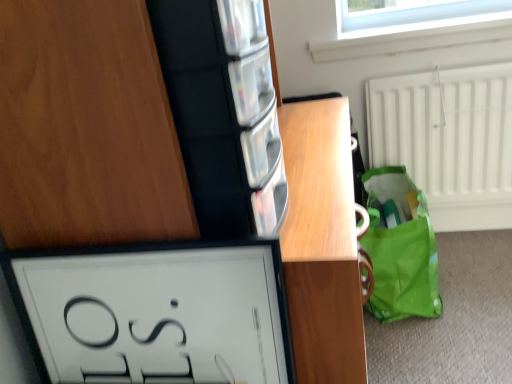
Question: From a real-world perspective, does green fabric tote at lower right stand above matte wood cabinet at upper left?

Choices:
 (A) yes
 (B) no

Answer: (B)

Question: Does green fabric tote at lower right have a lesser width compared to matte wood cabinet at upper left?

Choices:
 (A) no
 (B) yes

Answer: (B)

Question: Can you confirm if green fabric tote at lower right is shorter than matte wood cabinet at upper left?

Choices:
 (A) no
 (B) yes

Answer: (A)

Question: Considering the relative positions of green fabric tote at lower right and matte wood cabinet at upper left in the image provided, is green fabric tote at lower right to the right of matte wood cabinet at upper left from the viewer's perspective?

Choices:
 (A) yes
 (B) no

Answer: (A)

Question: Is green fabric tote at lower right wider than matte wood cabinet at upper left?

Choices:
 (A) yes
 (B) no

Answer: (B)

Question: From a real-world perspective, is clear glass window at upper center positioned above or below green fabric tote at lower right?

Choices:
 (A) above
 (B) below

Answer: (A)

Question: Considering the positions of point (415, 16) and point (370, 251), is point (415, 16) closer or farther from the camera than point (370, 251)?

Choices:
 (A) farther
 (B) closer

Answer: (A)

Question: Looking at their shapes, would you say clear glass window at upper center is wider or thinner than green fabric tote at lower right?

Choices:
 (A) thin
 (B) wide

Answer: (B)

Question: In terms of size, does clear glass window at upper center appear bigger or smaller than green fabric tote at lower right?

Choices:
 (A) small
 (B) big

Answer: (A)

Question: From a real-world perspective, is green fabric tote at lower right above or below white glossy picture frame at lower left?

Choices:
 (A) above
 (B) below

Answer: (B)

Question: Considering the relative positions of green fabric tote at lower right and white glossy picture frame at lower left in the image provided, is green fabric tote at lower right to the left or to the right of white glossy picture frame at lower left?

Choices:
 (A) left
 (B) right

Answer: (B)

Question: Considering the positions of point (415, 258) and point (237, 269), is point (415, 258) closer or farther from the camera than point (237, 269)?

Choices:
 (A) farther
 (B) closer

Answer: (A)

Question: In terms of width, does green fabric tote at lower right look wider or thinner when compared to white glossy picture frame at lower left?

Choices:
 (A) wide
 (B) thin

Answer: (A)

Question: Is point (93, 258) closer or farther from the camera than point (84, 130)?

Choices:
 (A) farther
 (B) closer

Answer: (A)

Question: Is white glossy picture frame at lower left in front of or behind matte wood cabinet at upper left in the image?

Choices:
 (A) behind
 (B) front

Answer: (A)